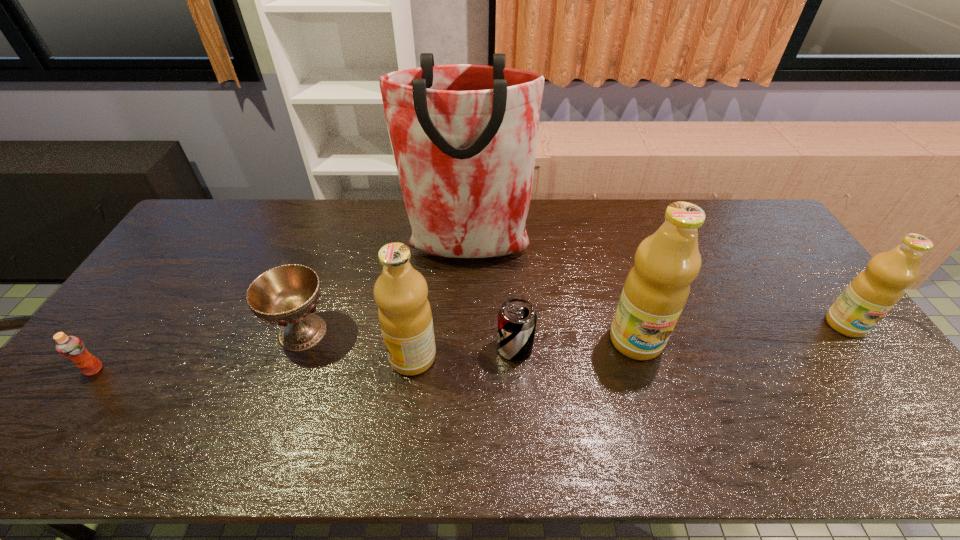
Where is `vacant area situated on the label of the fifth shortest object`? The image size is (960, 540). vacant area situated on the label of the fifth shortest object is located at coordinates (291, 357).

Find the location of `free point located on the label of the fifth shortest object`. free point located on the label of the fifth shortest object is located at coordinates (295, 357).

Locate an element on the screen. blank area located 0.110m on the label of the fifth shortest object is located at coordinates (348, 357).

This screenshot has height=540, width=960. Find the location of `vacant position located on the label of the sixth object from left to right`. vacant position located on the label of the sixth object from left to right is located at coordinates (660, 415).

The image size is (960, 540). Find the location of `vacant space situated 0.060m on the label of the rightmost olive oil`. vacant space situated 0.060m on the label of the rightmost olive oil is located at coordinates (870, 357).

Locate an element on the screen. This screenshot has height=540, width=960. vacant space situated on the right of the chalice is located at coordinates (396, 332).

The width and height of the screenshot is (960, 540). I want to click on vacant area situated on the right of the grocery bag, so click(x=552, y=252).

Identify the location of free space located on the right of the orange juice. (169, 369).

In order to click on free space located on the back of the soda can in this screenshot , I will do `click(509, 258)`.

The image size is (960, 540). Find the location of `object present at the far edge`. object present at the far edge is located at coordinates (464, 137).